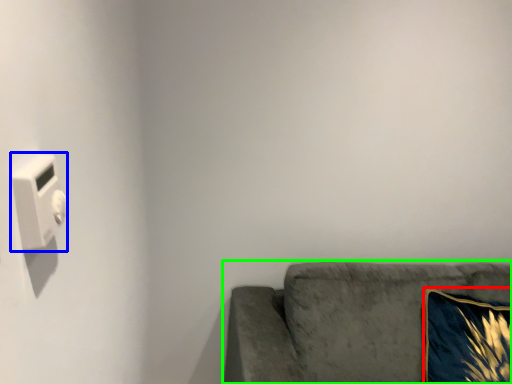
Question: Which is farther away from throw pillow (highlighted by a red box)? light switch (highlighted by a blue box) or studio couch (highlighted by a green box)?

Choices:
 (A) light switch
 (B) studio couch

Answer: (A)